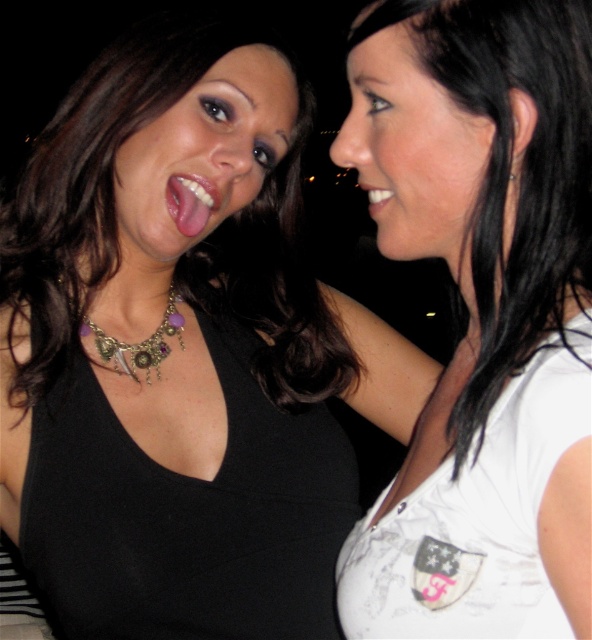
You are a photographer at a party. You want to take a photo of the silver metallic earring at upper right without the white matte shirt at right blocking it. Is this possible given their positions?

The white matte shirt at right is in front of the silver metallic earring at upper right, so it would block the view of the earring. To capture the earring without obstruction, you would need to adjust the angle or position to move the shirt out of the way.